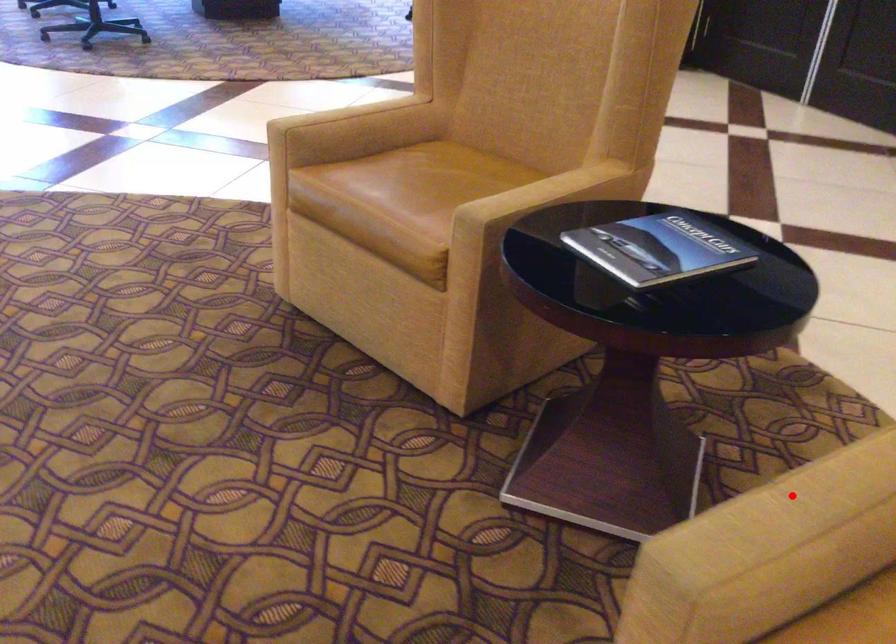
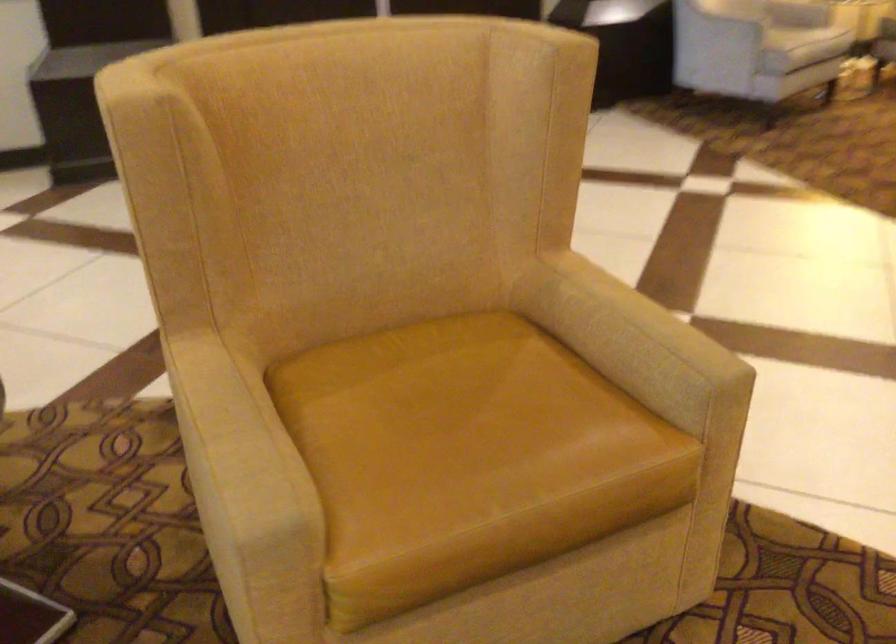
In the second image, find the point that corresponds to the highlighted location in the first image.

(235, 435)